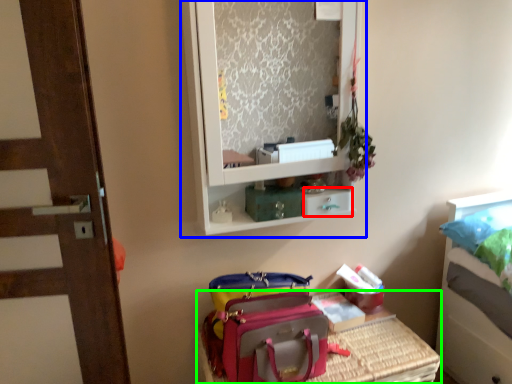
Question: Considering the real-world distances, which object is farthest from drawer (highlighted by a red box)? medicine cabinet (highlighted by a blue box) or furniture (highlighted by a green box)?

Choices:
 (A) medicine cabinet
 (B) furniture

Answer: (A)